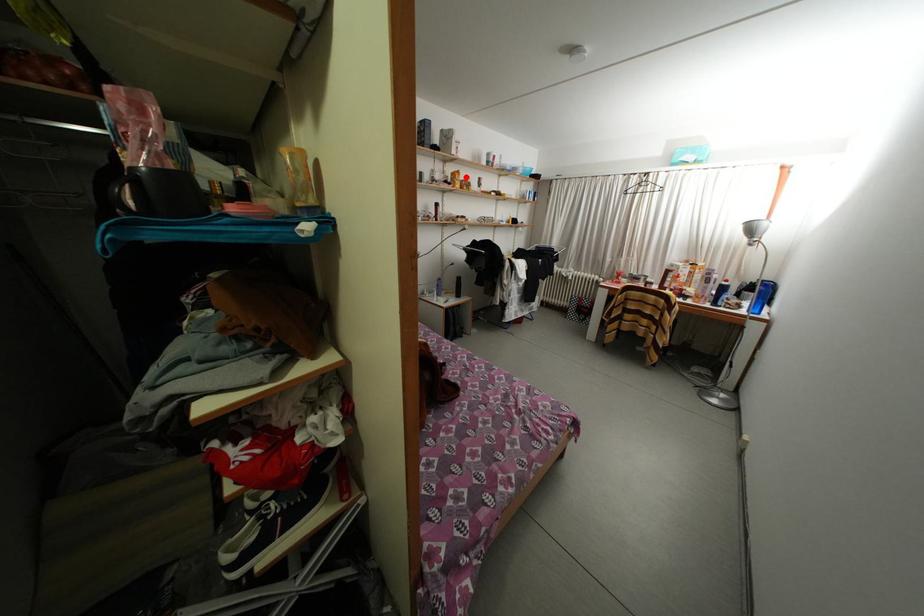
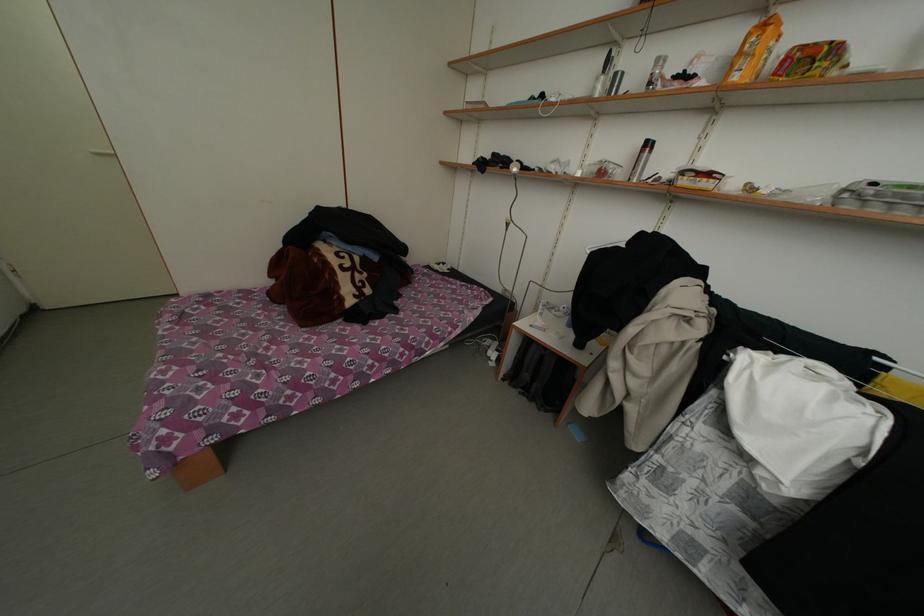
Question: I am providing you with two images of the same scene from different viewpoints. Given a red point in image1, look at the same physical point in image2. Is it:

Choices:
 (A) Closer to the viewpoint
 (B) Farther from the viewpoint

Answer: (B)